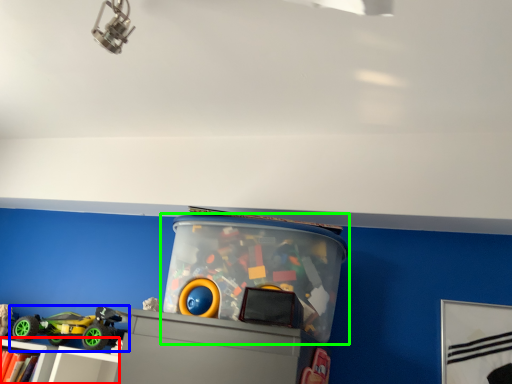
Question: Which object is the farthest from shelf (highlighted by a red box)? Choose among these: toy (highlighted by a blue box) or toy (highlighted by a green box).

Choices:
 (A) toy
 (B) toy

Answer: (B)